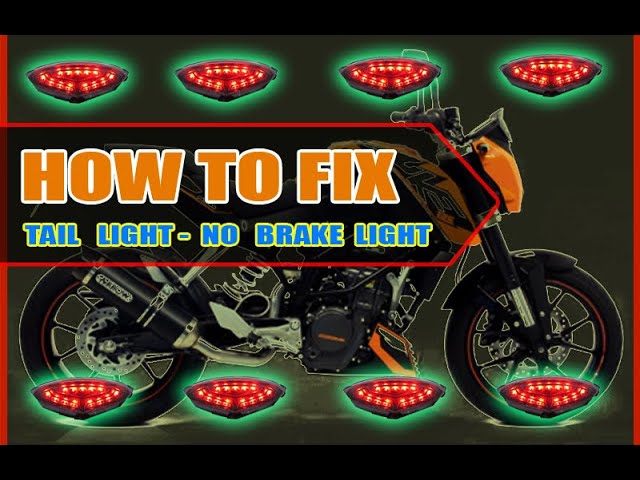
Where is `handle`? handle is located at coordinates (403, 115).